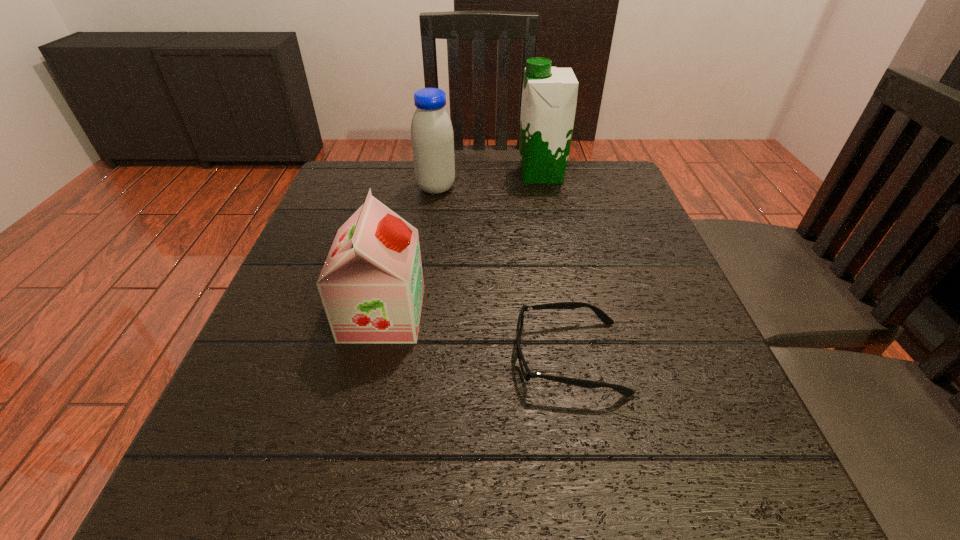
Identify the location of free space located on the front-facing side of the shortest object. (467, 357).

The width and height of the screenshot is (960, 540). What are the coordinates of `object that is at the left edge` in the screenshot? It's located at (371, 285).

Locate an element on the screen. Image resolution: width=960 pixels, height=540 pixels. soya milk that is at the right edge is located at coordinates (549, 96).

Locate an element on the screen. This screenshot has width=960, height=540. spectacles located at the right edge is located at coordinates (527, 374).

The height and width of the screenshot is (540, 960). I want to click on object that is at the far right corner, so [x=549, y=96].

The width and height of the screenshot is (960, 540). In the image, there is a desktop. In order to click on vacant region at the far edge in this screenshot , I will do `click(520, 184)`.

Find the location of a particular element. Image resolution: width=960 pixels, height=540 pixels. free space at the left edge of the desktop is located at coordinates (296, 272).

You are a GUI agent. You are given a task and a screenshot of the screen. Output one action in this format:
    pyautogui.click(x=<x>, y=<y>)
    Task: Click on the vacant space at the right edge of the desktop
    This screenshot has width=960, height=540.
    Given the screenshot: What is the action you would take?
    pyautogui.click(x=708, y=451)

You are a GUI agent. You are given a task and a screenshot of the screen. Output one action in this format:
    pyautogui.click(x=<x>, y=<y>)
    Task: Click on the vacant space at the far left corner of the desktop
    The image size is (960, 540).
    Given the screenshot: What is the action you would take?
    pyautogui.click(x=390, y=161)

At what (x,y) coordinates should I click in order to perform the action: click on vacant region at the far right corner. Please return your answer as a coordinate pair (x, y). The image size is (960, 540). Looking at the image, I should click on (606, 174).